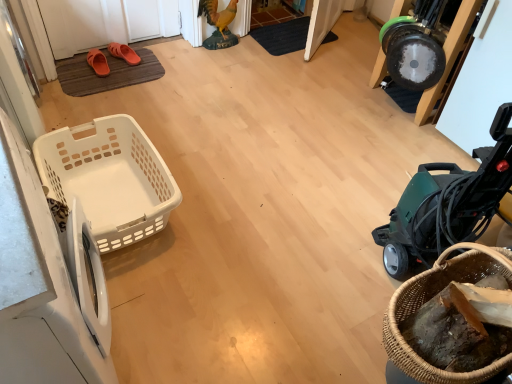
At what (x,y) coordinates should I click in order to perform the action: click on free space to the back side of white plastic basket at left, the 1th basket viewed from the left. Please return your answer as a coordinate pair (x, y). This screenshot has height=384, width=512. Looking at the image, I should click on click(178, 130).